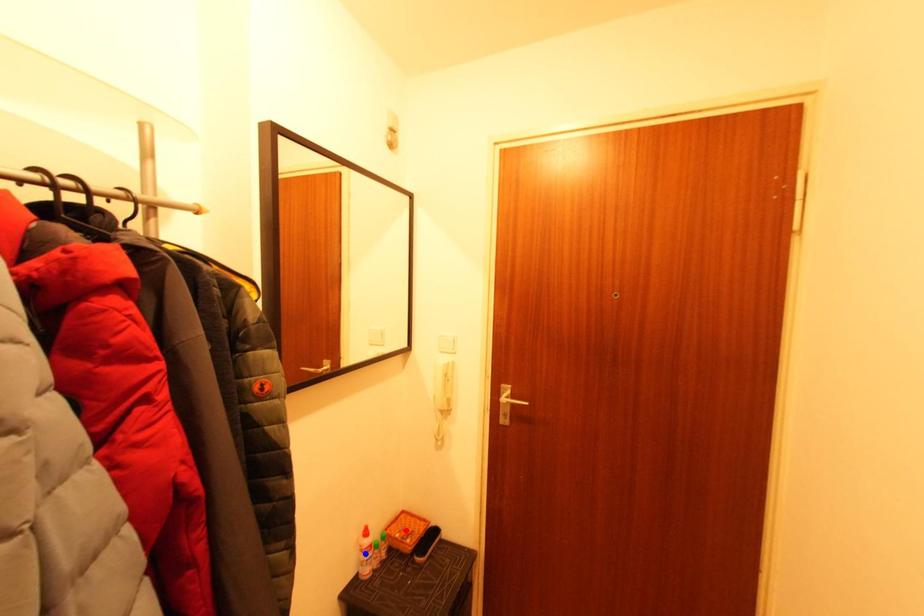
Question: In the image, two points are highlighted. Which point is nearer to the camera? Reply with the corresponding letter.

Choices:
 (A) blue point
 (B) red point

Answer: (A)